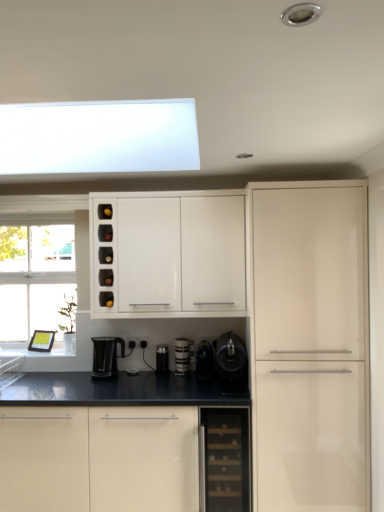
Find the location of a particular element. This screenshot has height=512, width=384. white glossy coffee cup at center, positioned as the third appliance in right-to-left order is located at coordinates (183, 355).

This screenshot has height=512, width=384. Identify the location of white glossy cabinet at lower center, marked as the 1th cabinetry in a bottom-to-top arrangement. (99, 459).

How much space does black plastic coffee machine at center, the 1th appliance in the right-to-left sequence, occupy vertically?

38.32 centimeters.

In order to face black plastic coffee maker at center, the 3th appliance in the left-to-right sequence, should I rotate leftwards or rightwards?

Turn right approximately 1.774 degrees to face it.

Measure the distance between point (246, 467) and camera.

The distance of point (246, 467) from camera is 2.41 meters.

Find the location of a particular element. The image size is (384, 512). white glossy coffee cup at center, acting as the second appliance starting from the left is located at coordinates (183, 355).

Considering the relative sizes of white glossy cabinet at lower center, marked as the 1th cabinetry in a bottom-to-top arrangement, and matte black coffee maker at center, acting as the fourth appliance starting from the right, in the image provided, is white glossy cabinet at lower center, marked as the 1th cabinetry in a bottom-to-top arrangement, taller than matte black coffee maker at center, acting as the fourth appliance starting from the right,?

Yes, white glossy cabinet at lower center, marked as the 1th cabinetry in a bottom-to-top arrangement, is taller than matte black coffee maker at center, acting as the fourth appliance starting from the right.

Could you tell me if white glossy cabinet at lower center, marked as the 1th cabinetry in a bottom-to-top arrangement, is turned towards matte black coffee maker at center, which is counted as the first appliance, starting from the left?

No, white glossy cabinet at lower center, marked as the 1th cabinetry in a bottom-to-top arrangement, does not turn towards matte black coffee maker at center, which is counted as the first appliance, starting from the left.

Is white glossy cabinet at lower center, which ranks as the second cabinetry in top-to-bottom order, not close to matte black coffee maker at center, acting as the fourth appliance starting from the right?

No, white glossy cabinet at lower center, which ranks as the second cabinetry in top-to-bottom order, is not far from matte black coffee maker at center, acting as the fourth appliance starting from the right.

Is point (75, 506) closer or farther from the camera than point (165, 359)?

Clearly, point (75, 506) is closer to the camera than point (165, 359).

In the scene shown: Does black plastic coffee maker at center, the 3th appliance in the left-to-right sequence, appear on the right side of matte black coffee maker at center, acting as the fourth appliance starting from the right?

Indeed, black plastic coffee maker at center, the 3th appliance in the left-to-right sequence, is positioned on the right side of matte black coffee maker at center, acting as the fourth appliance starting from the right.

Which object is closer to the camera taking this photo, black plastic coffee maker at center, which is counted as the second appliance, starting from the right, or matte black coffee maker at center, which is counted as the first appliance, starting from the left?

Positioned in front is black plastic coffee maker at center, which is counted as the second appliance, starting from the right.

Does black plastic coffee maker at center, which is counted as the second appliance, starting from the right, have a lesser height compared to matte black coffee maker at center, which is counted as the first appliance, starting from the left?

No.

Can you tell me how much black plastic coffee maker at center, which is counted as the second appliance, starting from the right, and matte black coffee maker at center, acting as the fourth appliance starting from the right, differ in facing direction?

black plastic coffee maker at center, which is counted as the second appliance, starting from the right, and matte black coffee maker at center, acting as the fourth appliance starting from the right, are facing 1.42 degrees away from each other.

Considering the relative sizes of white glossy coffee cup at center, acting as the second appliance starting from the left, and white glossy cabinet at upper center, positioned as the first cabinetry in top-to-bottom order, in the image provided, is white glossy coffee cup at center, acting as the second appliance starting from the left, shorter than white glossy cabinet at upper center, positioned as the first cabinetry in top-to-bottom order,?

Yes.

Is white glossy coffee cup at center, positioned as the third appliance in right-to-left order, facing towards white glossy cabinet at upper center, the second cabinetry from the bottom?

No, white glossy coffee cup at center, positioned as the third appliance in right-to-left order, is not turned towards white glossy cabinet at upper center, the second cabinetry from the bottom.

From a real-world perspective, count 3rd appliances downward from the white glossy cabinet at upper center, the second cabinetry from the bottom, and point to it. Please provide its 2D coordinates.

[(183, 355)]

Is white glossy coffee cup at center, acting as the second appliance starting from the left, closer to camera compared to white glossy cabinet at upper center, positioned as the first cabinetry in top-to-bottom order?

No, the depth of white glossy coffee cup at center, acting as the second appliance starting from the left, is greater than that of white glossy cabinet at upper center, positioned as the first cabinetry in top-to-bottom order.

Is white glossy coffee cup at center, positioned as the third appliance in right-to-left order, outside of black glass dishwasher at lower center?

Yes.

Which is more to the right, white glossy coffee cup at center, positioned as the third appliance in right-to-left order, or black glass dishwasher at lower center?

Positioned to the right is black glass dishwasher at lower center.

From the image's perspective, is white glossy coffee cup at center, acting as the second appliance starting from the left, located beneath black glass dishwasher at lower center?

No, from the image's perspective, white glossy coffee cup at center, acting as the second appliance starting from the left, is not beneath black glass dishwasher at lower center.

Considering the sizes of objects white glossy coffee cup at center, positioned as the third appliance in right-to-left order, and black glass dishwasher at lower center in the image provided, who is smaller, white glossy coffee cup at center, positioned as the third appliance in right-to-left order, or black glass dishwasher at lower center?

white glossy coffee cup at center, positioned as the third appliance in right-to-left order.

Who is more distant, black glass dishwasher at lower center or white glossy cabinet at upper center, positioned as the first cabinetry in top-to-bottom order?

white glossy cabinet at upper center, positioned as the first cabinetry in top-to-bottom order, is more distant.

Is black glass dishwasher at lower center to the right of white glossy cabinet at upper center, positioned as the first cabinetry in top-to-bottom order, from the viewer's perspective?

Correct, you'll find black glass dishwasher at lower center to the right of white glossy cabinet at upper center, positioned as the first cabinetry in top-to-bottom order.

Does point (248, 456) lie in front of point (189, 232)?

That is True.

Is black plastic coffee machine at center, the 1th appliance in the right-to-left sequence, positioned behind black glass dishwasher at lower center?

That is True.

Looking at this image, considering the relative sizes of black plastic coffee machine at center, which is the 4th appliance in left-to-right order, and black glass dishwasher at lower center in the image provided, is black plastic coffee machine at center, which is the 4th appliance in left-to-right order, shorter than black glass dishwasher at lower center?

Yes, black plastic coffee machine at center, which is the 4th appliance in left-to-right order, is shorter than black glass dishwasher at lower center.

How many degrees apart are the facing directions of black plastic coffee machine at center, which is the 4th appliance in left-to-right order, and black glass dishwasher at lower center?

There is a 2.79-degree angle between the facing directions of black plastic coffee machine at center, which is the 4th appliance in left-to-right order, and black glass dishwasher at lower center.

Is matte black coffee maker at center, acting as the fourth appliance starting from the right, smaller than white glossy cabinet at lower center, marked as the 1th cabinetry in a bottom-to-top arrangement?

Indeed, matte black coffee maker at center, acting as the fourth appliance starting from the right, has a smaller size compared to white glossy cabinet at lower center, marked as the 1th cabinetry in a bottom-to-top arrangement.

Considering the sizes of matte black coffee maker at center, which is counted as the first appliance, starting from the left, and white glossy cabinet at lower center, marked as the 1th cabinetry in a bottom-to-top arrangement, in the image, is matte black coffee maker at center, which is counted as the first appliance, starting from the left, taller or shorter than white glossy cabinet at lower center, marked as the 1th cabinetry in a bottom-to-top arrangement,?

Considering their sizes, matte black coffee maker at center, which is counted as the first appliance, starting from the left, has less height than white glossy cabinet at lower center, marked as the 1th cabinetry in a bottom-to-top arrangement.

Which object is positioned more to the left, matte black coffee maker at center, acting as the fourth appliance starting from the right, or white glossy cabinet at lower center, marked as the 1th cabinetry in a bottom-to-top arrangement?

From the viewer's perspective, white glossy cabinet at lower center, marked as the 1th cabinetry in a bottom-to-top arrangement, appears more on the left side.

Considering the points (162, 367) and (120, 438), which point is behind, point (162, 367) or point (120, 438)?

Point (162, 367)

You are a GUI agent. You are given a task and a screenshot of the screen. Output one action in this format:
    pyautogui.click(x=<x>, y=<y>)
    Task: Click on the 2nd cabinetry in front of the matte black coffee maker at center, acting as the fourth appliance starting from the right, counting from the anchor's position
    The width and height of the screenshot is (384, 512).
    Given the screenshot: What is the action you would take?
    pyautogui.click(x=99, y=459)

The height and width of the screenshot is (512, 384). I want to click on appliance that is the 2nd one when counting upward from the matte black coffee maker at center, acting as the fourth appliance starting from the right (from the image's perspective), so click(x=205, y=362).

Considering their positions, is black plastic coffee machine at center, which is the 4th appliance in left-to-right order, positioned closer to black plastic coffee maker at center, the 3th appliance in the left-to-right sequence, than white glossy coffee cup at center, positioned as the third appliance in right-to-left order?

black plastic coffee machine at center, which is the 4th appliance in left-to-right order, lies closer to black plastic coffee maker at center, the 3th appliance in the left-to-right sequence, than the other object.

Looking at this image, considering their positions, is matte black coffee maker at center, which is counted as the first appliance, starting from the left, positioned closer to white glossy coffee cup at center, acting as the second appliance starting from the left, than white glossy cabinet at right?

matte black coffee maker at center, which is counted as the first appliance, starting from the left.

From the image, which object appears to be farther from black plastic kettle at lower center, black plastic coffee maker at center, the 3th appliance in the left-to-right sequence, or white glossy cabinet at upper center, positioned as the first cabinetry in top-to-bottom order?

white glossy cabinet at upper center, positioned as the first cabinetry in top-to-bottom order.

Estimate the real-world distances between objects in this image. Which object is closer to black plastic coffee maker at center, which is counted as the second appliance, starting from the right, matte black coffee maker at center, which is counted as the first appliance, starting from the left, or white glossy coffee cup at center, positioned as the third appliance in right-to-left order?

white glossy coffee cup at center, positioned as the third appliance in right-to-left order, lies closer to black plastic coffee maker at center, which is counted as the second appliance, starting from the right, than the other object.

Considering their positions, is black plastic coffee maker at center, which is counted as the second appliance, starting from the right, positioned closer to white glossy cabinet at lower center, which ranks as the second cabinetry in top-to-bottom order, than black plastic kettle at lower center?

black plastic kettle at lower center.

Which object lies nearer to the anchor point black plastic kettle at lower center, black plastic coffee maker at center, which is counted as the second appliance, starting from the right, or white glossy cabinet at lower center, which ranks as the second cabinetry in top-to-bottom order?

Based on the image, white glossy cabinet at lower center, which ranks as the second cabinetry in top-to-bottom order, appears to be nearer to black plastic kettle at lower center.

When comparing their distances from black plastic coffee maker at center, the 3th appliance in the left-to-right sequence, does matte black coffee maker at center, which is counted as the first appliance, starting from the left, or black glass dishwasher at lower center seem further?

Based on the image, black glass dishwasher at lower center appears to be further to black plastic coffee maker at center, the 3th appliance in the left-to-right sequence.

From the image, which object appears to be farther from black plastic coffee machine at center, which is the 4th appliance in left-to-right order, black glass dishwasher at lower center or matte black coffee maker at center, acting as the fourth appliance starting from the right?

The object further to black plastic coffee machine at center, which is the 4th appliance in left-to-right order, is matte black coffee maker at center, acting as the fourth appliance starting from the right.

I want to click on appliance between black plastic coffee machine at center, the 1th appliance in the right-to-left sequence, and white glossy coffee cup at center, positioned as the third appliance in right-to-left order, in the front-back direction, so click(x=205, y=362).

In order to click on dish washer between white glossy cabinet at lower center, which ranks as the second cabinetry in top-to-bottom order, and black plastic coffee machine at center, the 1th appliance in the right-to-left sequence, from left to right in this screenshot , I will do `click(224, 459)`.

The width and height of the screenshot is (384, 512). I want to click on cabinetry between matte black coffee maker at center, which is counted as the first appliance, starting from the left, and white glossy cabinet at right from left to right, so click(x=168, y=254).

The width and height of the screenshot is (384, 512). I want to click on dish washer situated between black plastic kettle at lower center and black plastic coffee machine at center, which is the 4th appliance in left-to-right order, from left to right, so click(224, 459).